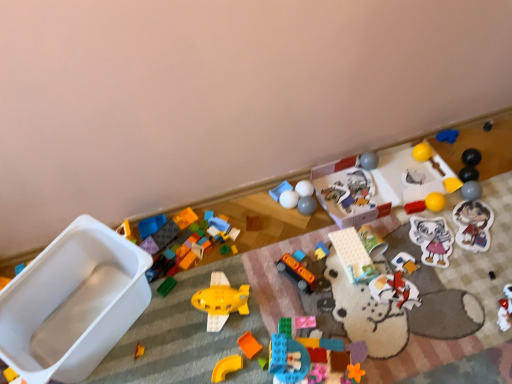
The height and width of the screenshot is (384, 512). What are the coordinates of `vacant space in between white matte figure at center, placed as the seventh toy when sorted from right to left, and white glossy sticker at center-right, arranged as the twentieth toy when viewed from the left` in the screenshot? It's located at (414, 260).